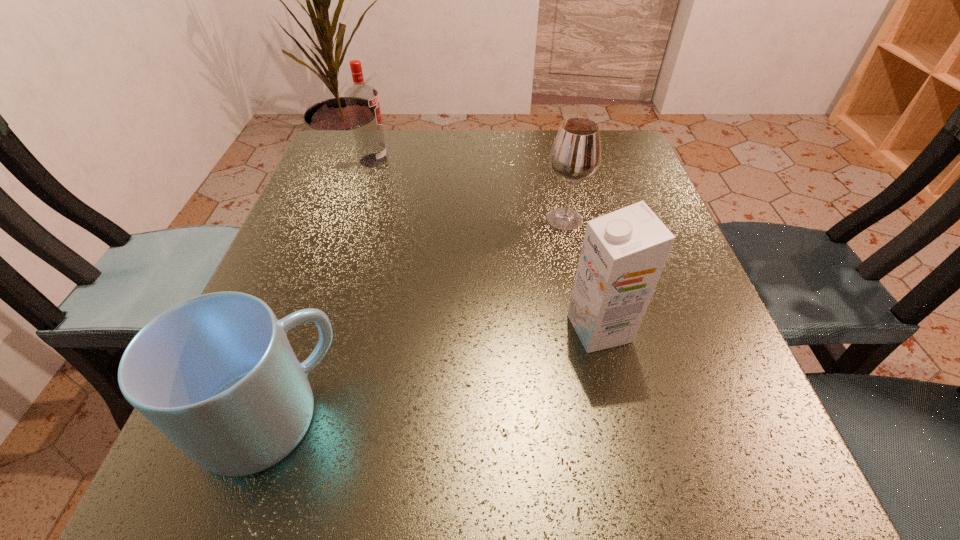
This screenshot has height=540, width=960. In order to click on the farthest object in this screenshot , I will do `click(362, 101)`.

Locate an element on the screen. The image size is (960, 540). the third farthest object is located at coordinates (623, 253).

I want to click on wineglass, so click(x=575, y=156).

In order to click on mug in this screenshot , I will do `click(216, 374)`.

You are a GUI agent. You are given a task and a screenshot of the screen. Output one action in this format:
    pyautogui.click(x=<x>, y=<y>)
    Task: Click on the vacant space located on the front label of the farthest object
    
    Given the screenshot: What is the action you would take?
    pyautogui.click(x=457, y=160)

Where is `free space located 0.320m on the left of the carton`? The image size is (960, 540). free space located 0.320m on the left of the carton is located at coordinates (366, 328).

Where is `free space located on the front of the third nearest object`? The image size is (960, 540). free space located on the front of the third nearest object is located at coordinates (593, 356).

Find the location of a particular element. Image resolution: width=960 pixels, height=540 pixels. vacant space located on the back of the nearest object is located at coordinates (321, 268).

Where is `object positioned at the far edge`? The height and width of the screenshot is (540, 960). object positioned at the far edge is located at coordinates (362, 101).

Identify the location of object situated at the near edge. This screenshot has height=540, width=960. (216, 374).